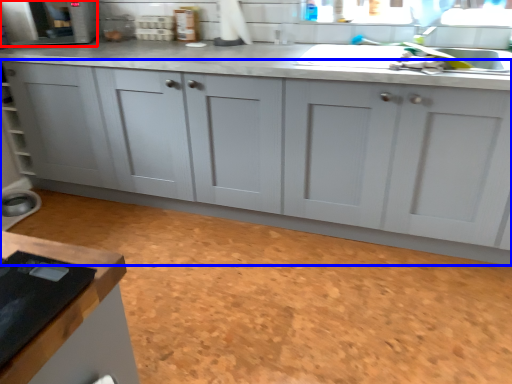
Question: Which point is closer to the camera, appliance (highlighted by a red box) or cabinetry (highlighted by a blue box)?

Choices:
 (A) appliance
 (B) cabinetry

Answer: (B)